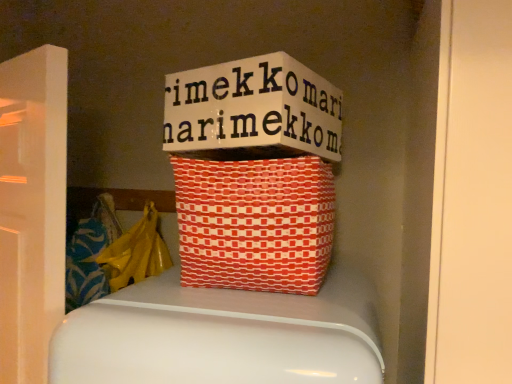
Question: Should I look upward or downward to see red woven basket at center?

Choices:
 (A) down
 (B) up

Answer: (A)

Question: Would you say yellow plastic bag at left is outside red woven basket at center?

Choices:
 (A) no
 (B) yes

Answer: (B)

Question: Is yellow plastic bag at left thinner than red woven basket at center?

Choices:
 (A) yes
 (B) no

Answer: (A)

Question: Is yellow plastic bag at left placed right next to red woven basket at center?

Choices:
 (A) yes
 (B) no

Answer: (B)

Question: From the image's perspective, is yellow plastic bag at left on top of red woven basket at center?

Choices:
 (A) yes
 (B) no

Answer: (B)

Question: Is yellow plastic bag at left facing away from red woven basket at center?

Choices:
 (A) no
 (B) yes

Answer: (A)

Question: From a real-world perspective, is yellow plastic bag at left positioned over red woven basket at center based on gravity?

Choices:
 (A) no
 (B) yes

Answer: (A)

Question: Does red woven basket at center lie in front of yellow plastic bag at left?

Choices:
 (A) yes
 (B) no

Answer: (A)

Question: Could you tell me if red woven basket at center is facing yellow plastic bag at left?

Choices:
 (A) no
 (B) yes

Answer: (A)

Question: Is red woven basket at center positioned beyond the bounds of yellow plastic bag at left?

Choices:
 (A) yes
 (B) no

Answer: (A)

Question: From a real-world perspective, is red woven basket at center positioned under yellow plastic bag at left based on gravity?

Choices:
 (A) no
 (B) yes

Answer: (A)

Question: Can you confirm if red woven basket at center is shorter than yellow plastic bag at left?

Choices:
 (A) no
 (B) yes

Answer: (B)

Question: Considering the relative sizes of red woven basket at center and yellow plastic bag at left in the image provided, is red woven basket at center wider than yellow plastic bag at left?

Choices:
 (A) yes
 (B) no

Answer: (A)

Question: In terms of width, does yellow plastic bag at left look wider or thinner when compared to red woven basket at center?

Choices:
 (A) thin
 (B) wide

Answer: (A)